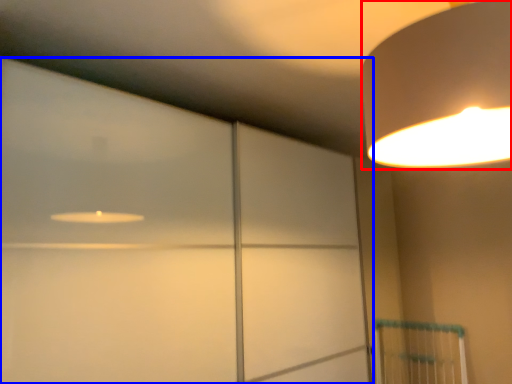
Question: Which of the following is the closest to the observer, lamp (highlighted by a red box) or glass door (highlighted by a blue box)?

Choices:
 (A) lamp
 (B) glass door

Answer: (A)